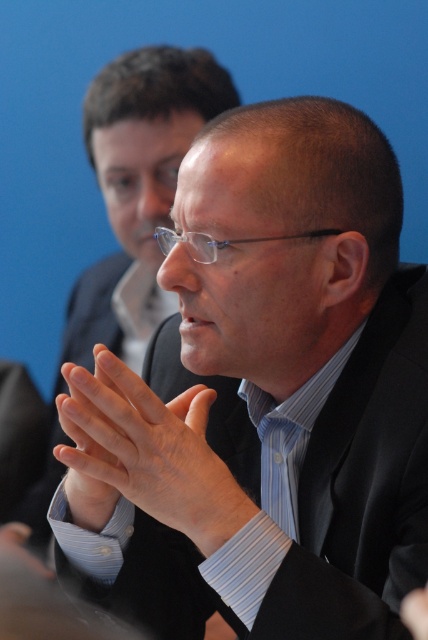
You are organizing a photo shoot and need to arrange two models wearing the same matte black suit at center and black matte suit at center. According to the scene description, which model should stand to the left to maintain symmetry in the photo?

The matte black suit at center should be placed to the left of the black matte suit at center to maintain symmetry, as the original scene shows the matte black suit at center positioned to the right of the black matte suit at center.

You are a photographer adjusting the focus on a camera. You have two points in the image, point (92,116) and point (192,442). Which point is closer to you?

Point (92,116) is closer to you because it is further to the viewer than point (192,442).

You are a photographer adjusting the focus of your camera to capture the two individuals in the image. Since you can only focus on one object at a time, which object should you choose to ensure the smooth skin hands at center are in focus while the black matte suit at center is slightly blurred?

The smooth skin hands at center is closer to the viewer than the black matte suit at center, so focusing on the smooth skin hands at center will keep them sharp while the black matte suit at center appears slightly blurred.